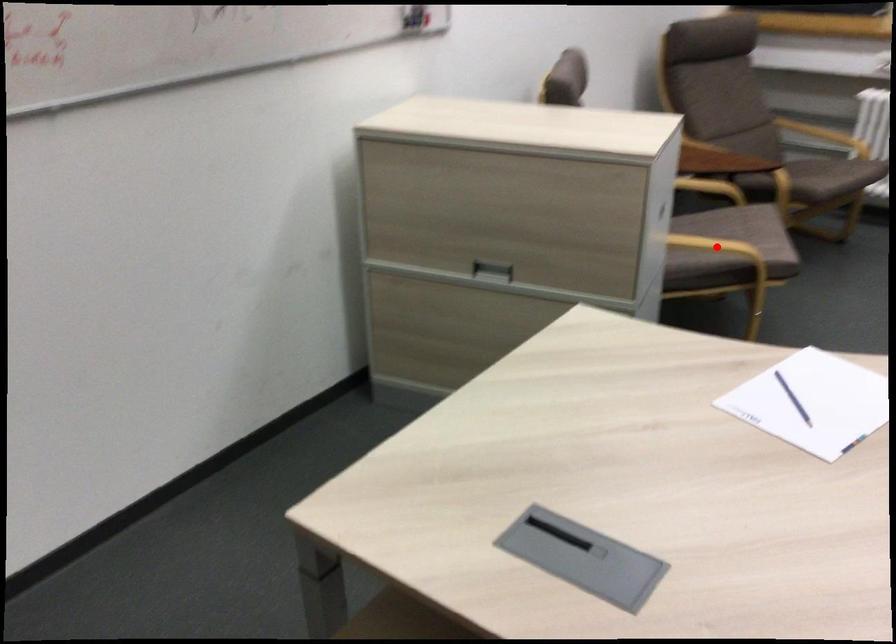
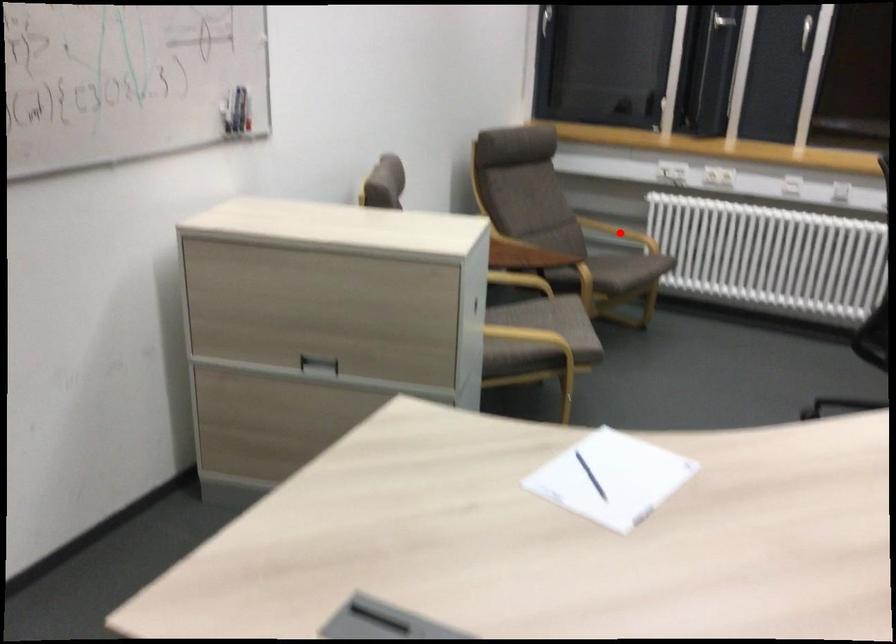
I am providing you with two images of the same scene from different viewpoints. A red point is marked on the first image and another point is marked on the second image. Does the point marked in image1 correspond to the same location as the one in image2?

No